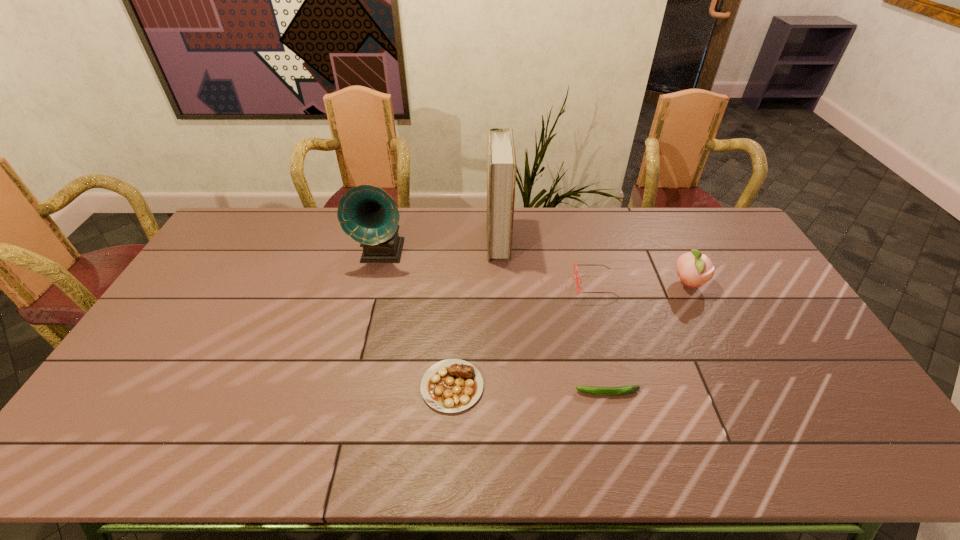
Select which object is the closest to the second object from left to right. Please provide its 2D coordinates. Your answer should be formatted as a tuple, i.e. [(x, y)], where the tuple contains the x and y coordinates of a point satisfying the conditions above.

[(623, 390)]

Select which object appears as the closest to the peach. Please provide its 2D coordinates. Your answer should be formatted as a tuple, i.e. [(x, y)], where the tuple contains the x and y coordinates of a point satisfying the conditions above.

[(574, 264)]

Where is `vacant space that satisfies the following two spatial constraints: 1. from the horn of the second tallest object; 2. on the right side of the second object from left to right`? vacant space that satisfies the following two spatial constraints: 1. from the horn of the second tallest object; 2. on the right side of the second object from left to right is located at coordinates (348, 386).

The width and height of the screenshot is (960, 540). I want to click on vacant space that satisfies the following two spatial constraints: 1. on the front side of the peach; 2. on the front-facing side of the fourth tallest object, so click(x=689, y=285).

Locate an element on the screen. vacant region that satisfies the following two spatial constraints: 1. on the cover of the peach; 2. on the right side of the tallest object is located at coordinates (500, 284).

I want to click on vacant region that satisfies the following two spatial constraints: 1. on the back side of the peach; 2. on the right side of the steak, so click(458, 284).

Locate an element on the screen. The image size is (960, 540). free space in the image that satisfies the following two spatial constraints: 1. on the front side of the rightmost object; 2. on the front-facing side of the zucchini is located at coordinates (743, 393).

Locate an element on the screen. The image size is (960, 540). free space that satisfies the following two spatial constraints: 1. from the horn of the fifth object from right to left; 2. on the left side of the leftmost object is located at coordinates (348, 386).